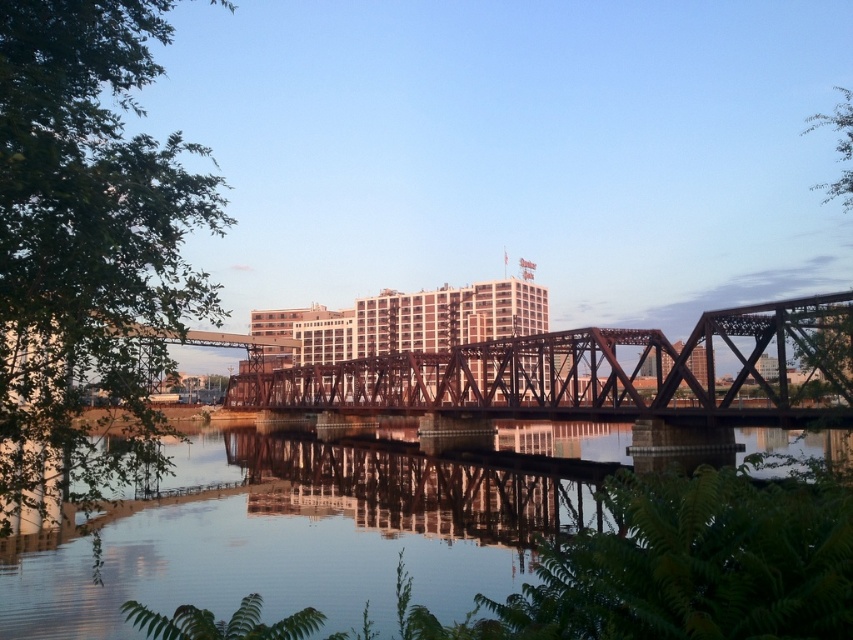
You are a city planner evaluating the riverside area. You need to determine if the clear water at center can accommodate a new small boat that is 10 meters wide. The rusty metal bridge at center has a known width of 12 meters. Can the boat pass under the bridge?

The clear water at center has a width less than the rusty metal bridge at center, which is 12 meters wide. Since the boat is 10 meters wide, it is narrower than the bridge. Therefore, the boat can pass under the bridge as its width is within the allowable limit.

You are a city planner reviewing the riverside area. You need to determine if the clear water at center can support a small boat that requires 2 meters of depth. The rusty metal bridge at center has a clearance of 3 meters. Can the boat pass under the bridge and navigate the water?

The clear water at center has a lesser height compared to the rusty metal bridge at center, meaning the water depth is less than the bridge height. Since the boat needs 2 meters of depth, but the water depth is less than the bridge height of 3 meters, it is unclear if the water is deep enough. Further measurements are needed to confirm if the depth meets the boat requirement.

In the scene shown: You are a boat captain planning to navigate a 60 feet long vessel through the area. You see the clear water at center and the rusty metal bridge at center. Can your vessel pass between them without touching either?

The clear water at center and the rusty metal bridge at center are 70.69 feet apart. Since your vessel is 60 feet long, it can safely pass between them as the distance is greater than the vessel length.